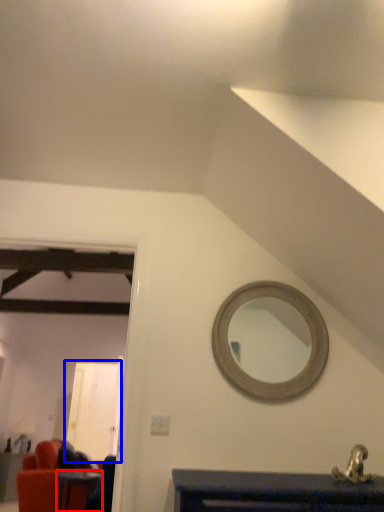
Question: Which point is further to the camera, table (highlighted by a red box) or glass door (highlighted by a blue box)?

Choices:
 (A) table
 (B) glass door

Answer: (B)